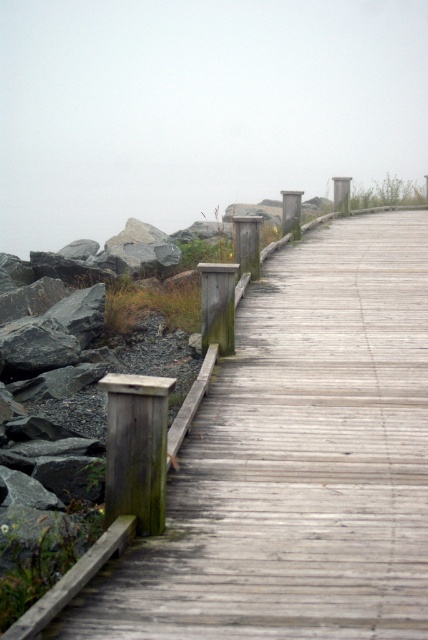
Question: Which point appears farthest from the camera in this image?

Choices:
 (A) (320, 256)
 (B) (21, 17)

Answer: (B)

Question: Which of the following is the farthest from the observer?

Choices:
 (A) weathered wood boardwalk at left
 (B) foggy gray at upper center

Answer: (B)

Question: Can you confirm if weathered wood boardwalk at left is smaller than foggy gray at upper center?

Choices:
 (A) no
 (B) yes

Answer: (B)

Question: Which of the following is the closest to the observer?

Choices:
 (A) weathered wood boardwalk at left
 (B) foggy gray at upper center

Answer: (A)

Question: Is weathered wood boardwalk at left thinner than foggy gray at upper center?

Choices:
 (A) yes
 (B) no

Answer: (A)

Question: Is weathered wood boardwalk at left bigger than foggy gray at upper center?

Choices:
 (A) no
 (B) yes

Answer: (A)